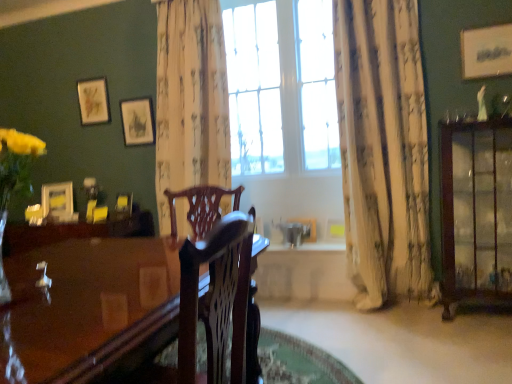
Image resolution: width=512 pixels, height=384 pixels. I want to click on free space on the front side of white textured curtain at right, which appears as the 1th curtain when viewed from the right, so click(407, 323).